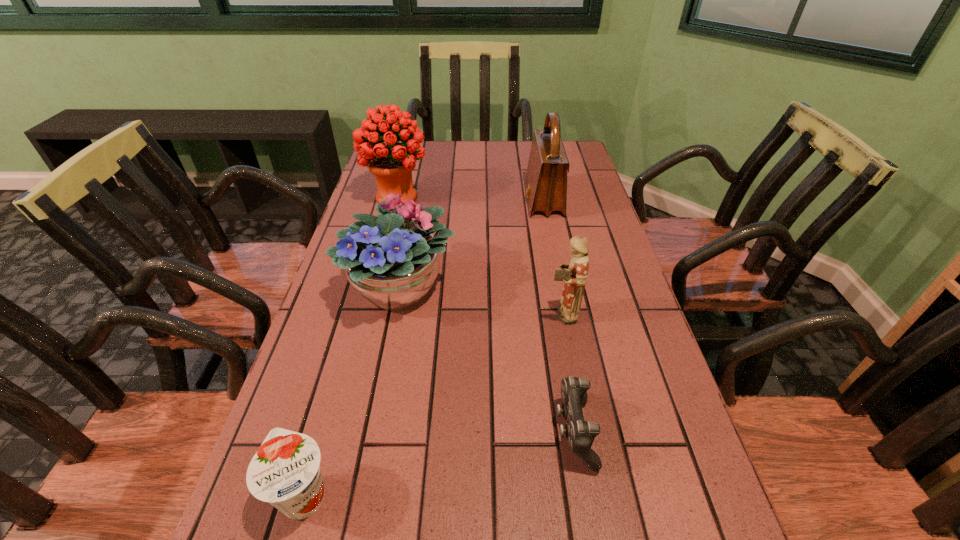
Where is `the farther bouquet`? The width and height of the screenshot is (960, 540). the farther bouquet is located at coordinates (392, 164).

This screenshot has width=960, height=540. I want to click on shoulder bag, so click(x=546, y=178).

Locate an element on the screen. Image resolution: width=960 pixels, height=540 pixels. the shorter bouquet is located at coordinates (391, 262).

Where is `figurine`? The width and height of the screenshot is (960, 540). figurine is located at coordinates (574, 275).

This screenshot has width=960, height=540. Find the location of `yogurt`. yogurt is located at coordinates (285, 471).

The width and height of the screenshot is (960, 540). In order to click on control in this screenshot , I will do `click(580, 434)`.

Locate an element on the screen. vacant space located on the front of the farther bouquet is located at coordinates (368, 308).

This screenshot has height=540, width=960. I want to click on free point located on the front flap of the shoulder bag, so click(x=473, y=201).

What are the coordinates of `vacant point located on the front flap of the shoulder bag` in the screenshot? It's located at (499, 201).

Locate an element on the screen. The width and height of the screenshot is (960, 540). vacant region located on the front flap of the shoulder bag is located at coordinates (418, 201).